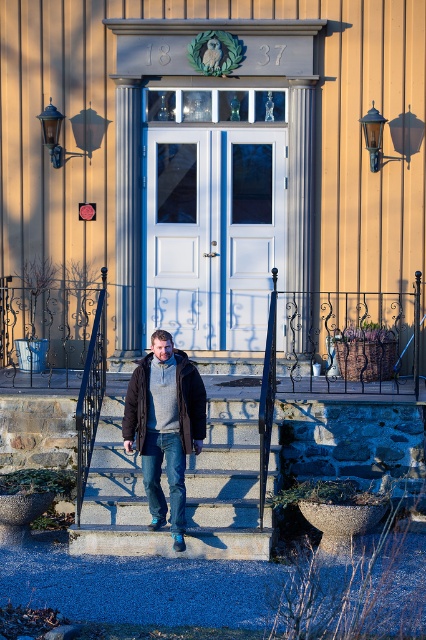
Question: Where is concrete stairs at center located in relation to black matte jacket at center in the image?

Choices:
 (A) right
 (B) left

Answer: (A)

Question: Can you confirm if dark gray woolen sweater at center is positioned to the right of black metal railing at lower left?

Choices:
 (A) yes
 (B) no

Answer: (A)

Question: Estimate the real-world distances between objects in this image. Which object is farther from the smooth concrete steps at center?

Choices:
 (A) dark gray woolen sweater at center
 (B) black matte jacket at center

Answer: (B)

Question: Among these points, which one is nearest to the camera?

Choices:
 (A) (92, 387)
 (B) (183, 404)

Answer: (B)

Question: Among these objects, which one is nearest to the camera?

Choices:
 (A) black metal railing at lower left
 (B) black matte jacket at center
 (C) smooth concrete steps at center
 (D) dark gray woolen sweater at center

Answer: (D)

Question: Does concrete stairs at center have a larger size compared to black metal railing at lower left?

Choices:
 (A) no
 (B) yes

Answer: (B)